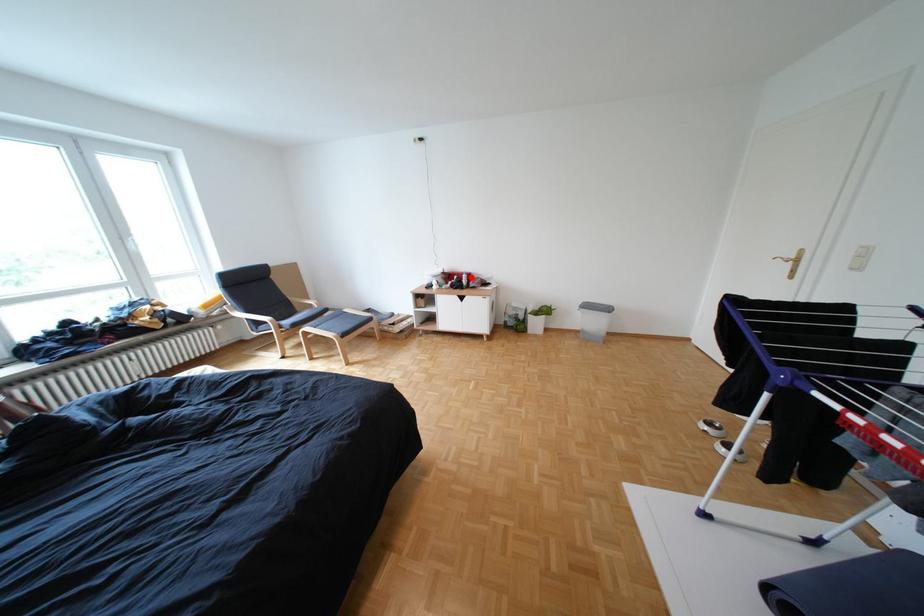
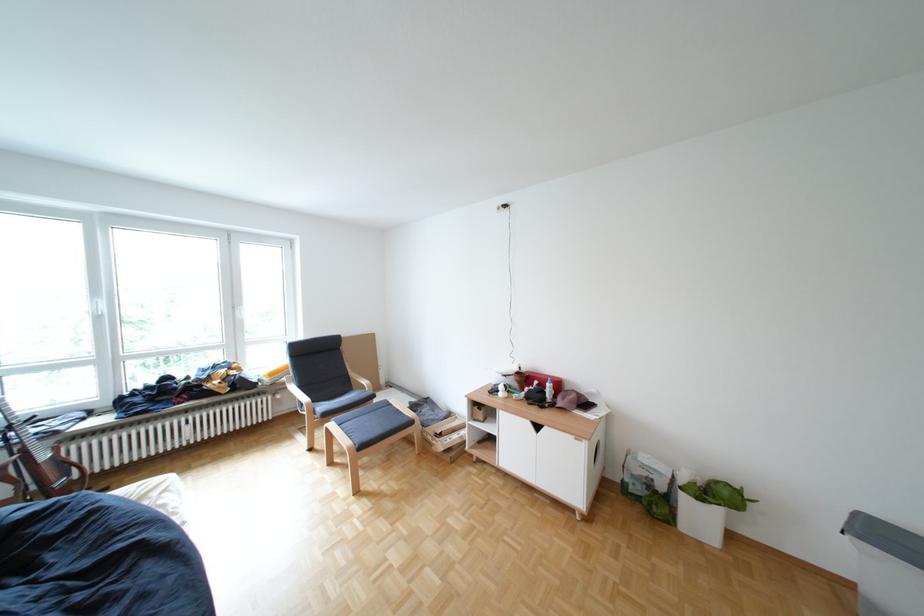
Question: A red point is marked in image1. In image2, is the corresponding 3D point closer to the camera or farther? Reply with the corresponding letter.

Choices:
 (A) The corresponding 3D point is closer.
 (B) The corresponding 3D point is farther.

Answer: (B)